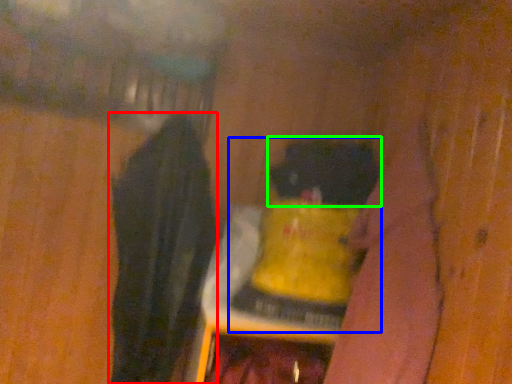
Question: Which object is the farthest from clothing (highlighted by a red box)? Choose among these: bottle (highlighted by a blue box) or animal (highlighted by a green box).

Choices:
 (A) bottle
 (B) animal

Answer: (B)